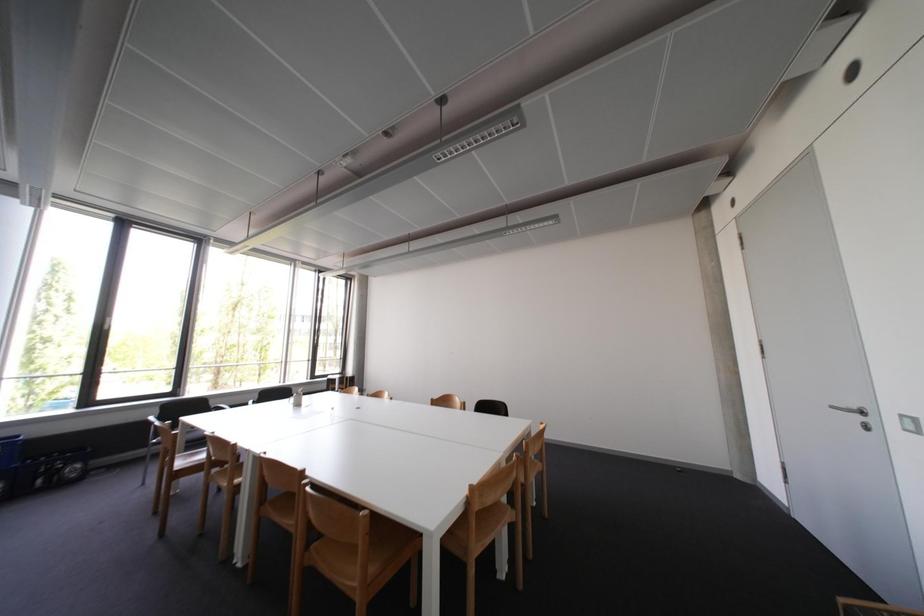
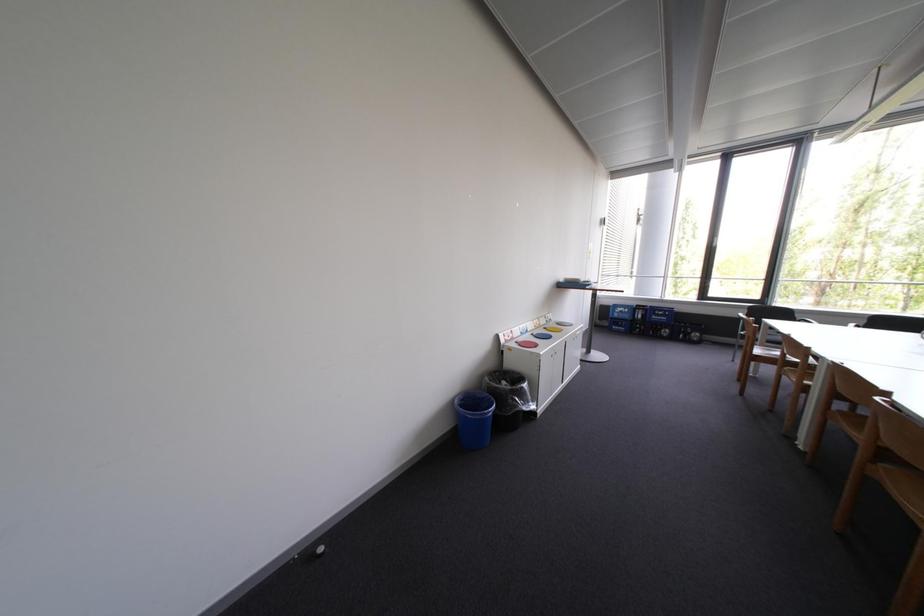
Question: The camera is either moving clockwise (left) or counter-clockwise (right) around the object. The first image is from the beginning of the video and the second image is from the end. Is the camera moving left or right when shooting the video?

Choices:
 (A) Left
 (B) Right

Answer: (B)